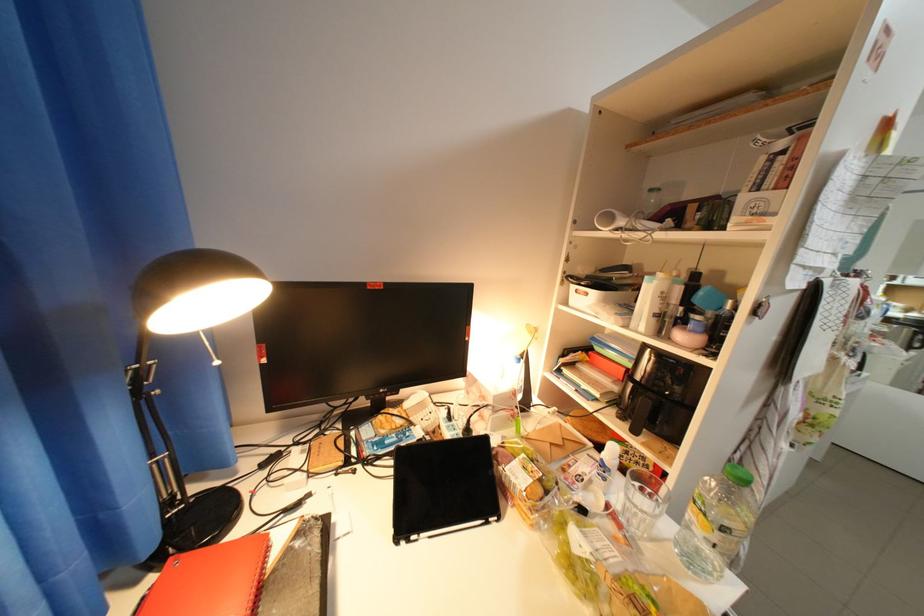
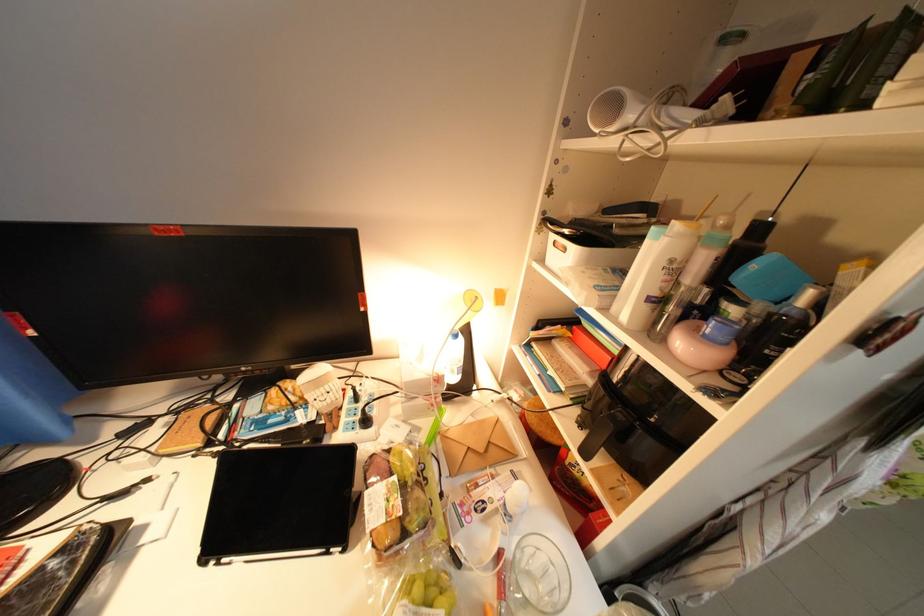
In the second image, find the point that corresponds to point (631, 525) in the first image.

(514, 591)